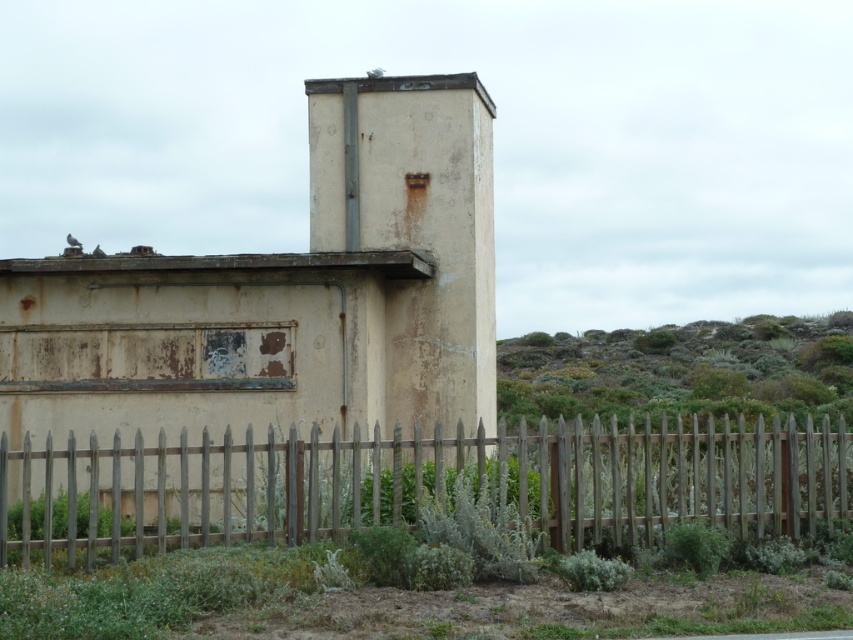
You are a painter assessing the area to paint both the rusty concrete chimney at center and the weathered wood fence at lower center. Which object requires more horizontal space to paint its full width?

The weathered wood fence at lower center requires more horizontal space to paint its full width because the rusty concrete chimney at center has a lesser width compared to it.